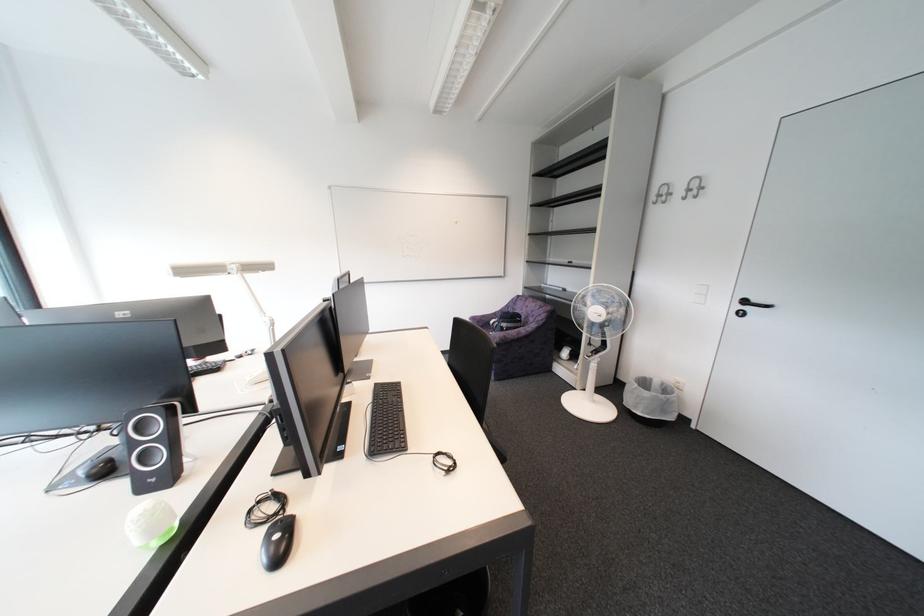
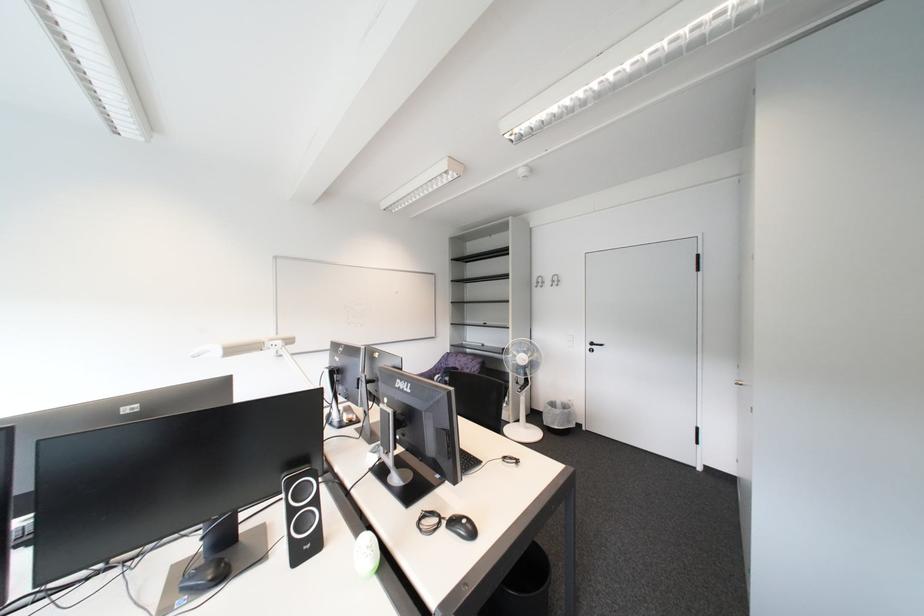
Question: How did the camera likely rotate?

Choices:
 (A) Left
 (B) Right
 (C) Up
 (D) Down

Answer: (B)